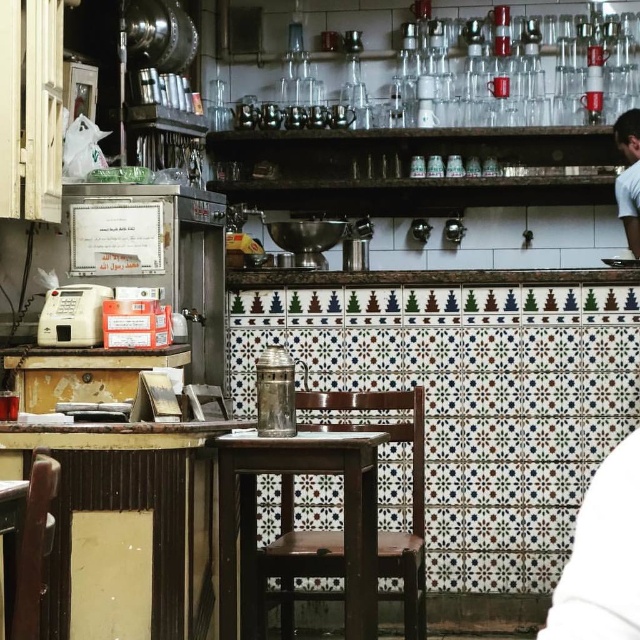
Is white fabric at lower right wider than white fabric shirt at upper right?

Yes, white fabric at lower right is wider than white fabric shirt at upper right.

This screenshot has height=640, width=640. I want to click on white fabric at lower right, so click(x=602, y=556).

The image size is (640, 640). I want to click on white fabric at lower right, so click(602, 556).

Which of these two, wooden bar stool at center or white fabric shirt at upper right, stands shorter?

wooden bar stool at center

Which is in front, point (355, 483) or point (637, 209)?

Point (355, 483) is in front.

Locate an element on the screen. The width and height of the screenshot is (640, 640). wooden bar stool at center is located at coordinates (256, 518).

Is point (243, 440) in front of point (561, 636)?

No, (243, 440) is further to viewer.

The image size is (640, 640). In order to click on wooden bar stool at center in this screenshot , I will do `click(256, 518)`.